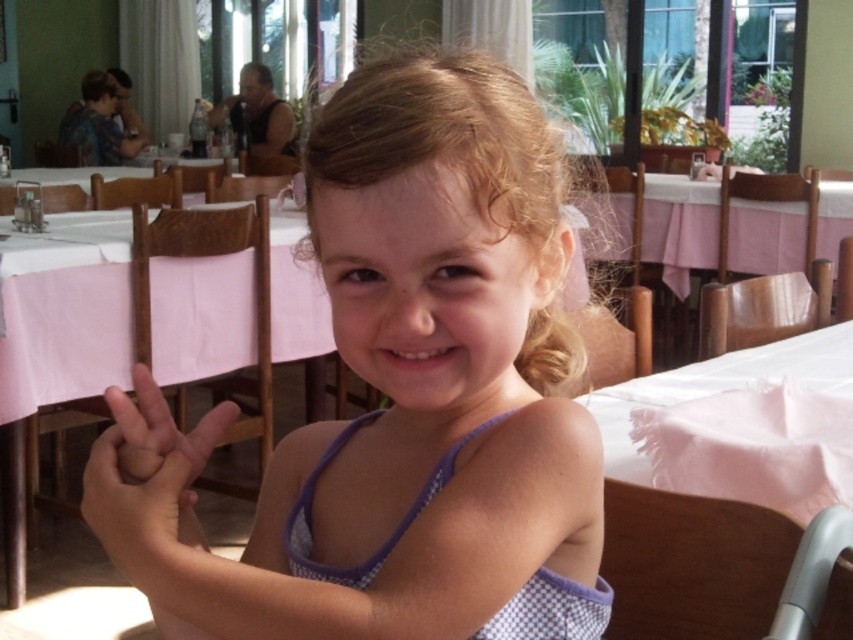
Is point (172, 448) positioned after point (680, 241)?

No, it is not.

Who is more distant from viewer, [181,545] or [793,227]?

Positioned behind is point [793,227].

Identify the location of smooth skin hand at center. The image size is (853, 640). (149, 483).

Can you confirm if white checkered dress at center is positioned below smooth skin hand at center?

Actually, white checkered dress at center is above smooth skin hand at center.

Is white checkered dress at center bigger than smooth skin hand at center?

Yes, white checkered dress at center is bigger than smooth skin hand at center.

Which is in front, point (461, 468) or point (138, 456)?

Point (138, 456)

The width and height of the screenshot is (853, 640). Find the location of `white checkered dress at center`. white checkered dress at center is located at coordinates (398, 396).

Can you confirm if white checkered dress at center is positioned above pink fabric table at center?

No.

Find the location of a particular element. Image resolution: width=853 pixels, height=640 pixels. white checkered dress at center is located at coordinates point(398,396).